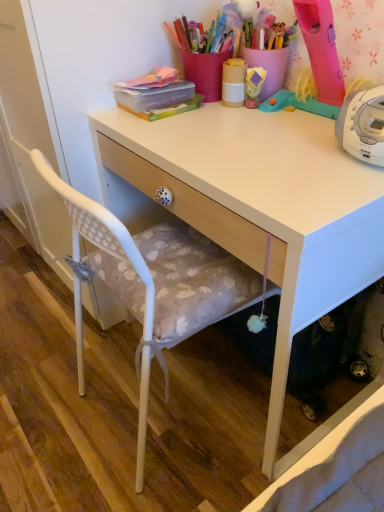
Question: In terms of width, does white plastic chair at left look wider or thinner when compared to matte yellow cup at upper center?

Choices:
 (A) wide
 (B) thin

Answer: (A)

Question: From the image's perspective, is white plastic chair at left positioned above or below matte yellow cup at upper center?

Choices:
 (A) below
 (B) above

Answer: (A)

Question: Estimate the real-world distances between objects in this image. Which object is closer to the white matte desk at center?

Choices:
 (A) matte yellow cup at upper center
 (B) white plastic chair at left

Answer: (B)

Question: Considering the real-world distances, which object is farthest from the white plastic chair at left?

Choices:
 (A) white matte desk at center
 (B) matte yellow cup at upper center

Answer: (B)